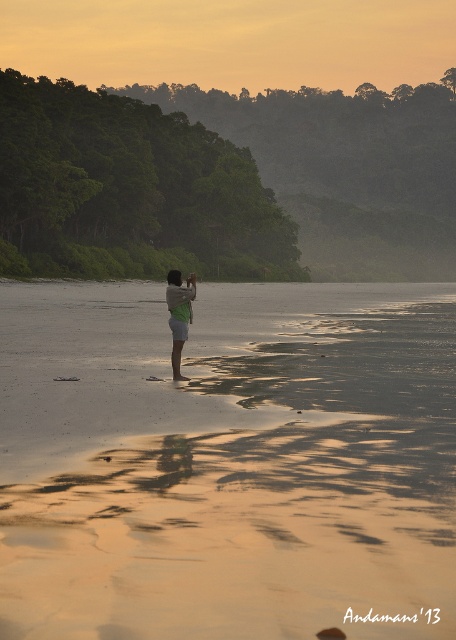
You are standing on the sandy beach at center and see the green fabric shorts at center in the distance. Which object is closer to you?

The sandy beach at center is in front of the green fabric shorts at center, so the sandy beach at center is closer to you.

You are standing at the point marked as point (228, 461) on the beach. Based on the scene description, what is the terrain like at your current location?

The terrain at point (228, 461) is sandy beach at center, which is described as wet sand with smooth and slightly reflective surface.